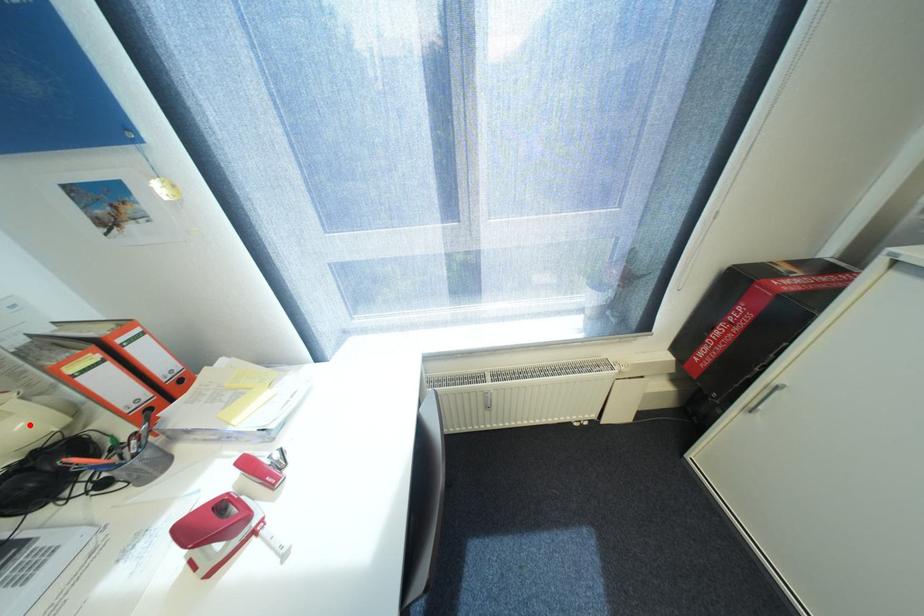
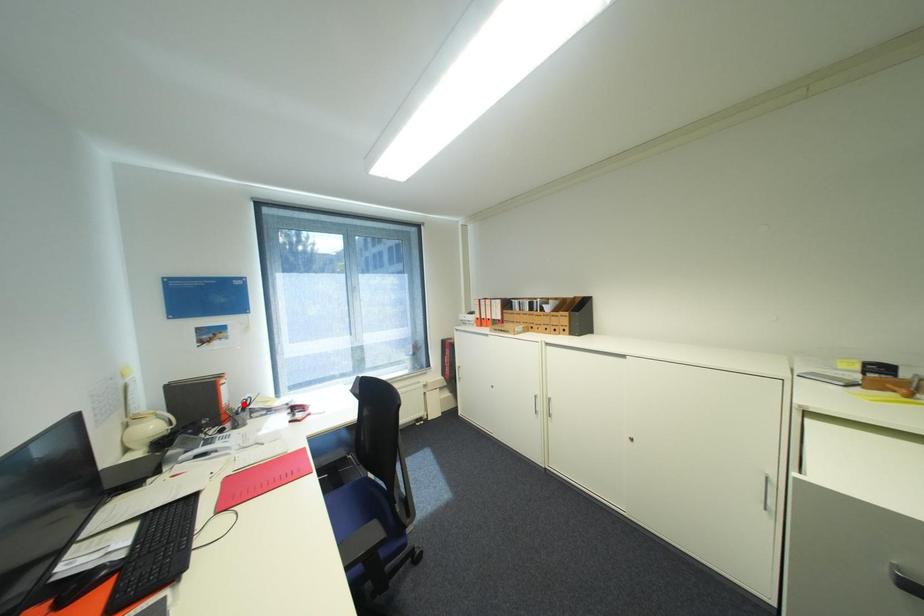
I am providing you with two images of the same scene from different viewpoints. A red point is marked on the first image and another point is marked on the second image. Is the red point in image1 aligned with the point shown in image2?

No